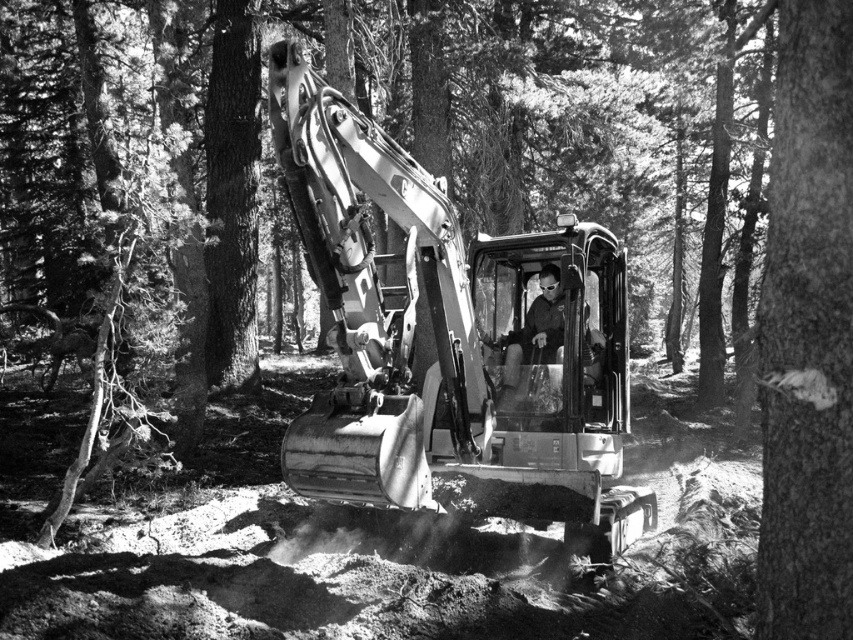
Is metallic gray excavator at center thinner than matte black helmet at center?

No, metallic gray excavator at center is not thinner than matte black helmet at center.

Between metallic gray excavator at center and matte black helmet at center, which one is positioned lower?

metallic gray excavator at center is lower down.

This screenshot has height=640, width=853. I want to click on metallic gray excavator at center, so click(450, 337).

Does smooth bark tree at center right have a smaller size compared to matte black helmet at center?

Indeed, smooth bark tree at center right has a smaller size compared to matte black helmet at center.

Which is behind, point (785, 170) or point (532, 314)?

The point (532, 314) is behind.

You are a GUI agent. You are given a task and a screenshot of the screen. Output one action in this format:
    pyautogui.click(x=<x>, y=<y>)
    Task: Click on the smooth bark tree at center right
    This screenshot has width=853, height=640.
    Given the screenshot: What is the action you would take?
    pyautogui.click(x=807, y=333)

Between metallic gray excavator at center and smooth bark tree at center right, which one appears on the left side from the viewer's perspective?

metallic gray excavator at center

The image size is (853, 640). Find the location of `metallic gray excavator at center`. metallic gray excavator at center is located at coordinates (450, 337).